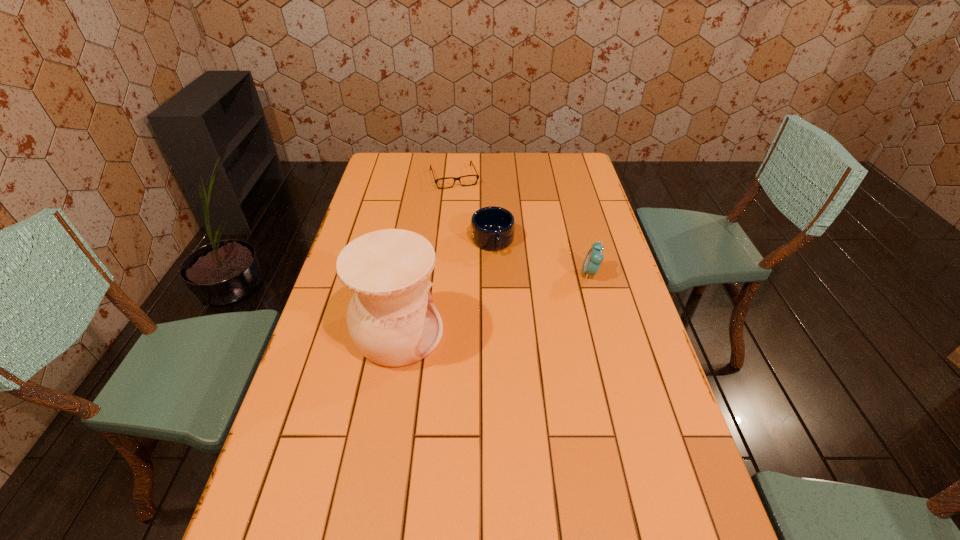
I want to click on object present at the right edge, so click(x=594, y=258).

The image size is (960, 540). I want to click on vacant region at the far edge of the desktop, so click(493, 176).

You are a GUI agent. You are given a task and a screenshot of the screen. Output one action in this format:
    pyautogui.click(x=<x>, y=<y>)
    Task: Click on the free space at the near edge of the desktop
    The image size is (960, 540).
    Given the screenshot: What is the action you would take?
    pyautogui.click(x=582, y=527)

I want to click on free point at the left edge, so click(351, 297).

Where is `vacant space at the right edge of the desktop`? Image resolution: width=960 pixels, height=540 pixels. vacant space at the right edge of the desktop is located at coordinates (608, 228).

The width and height of the screenshot is (960, 540). I want to click on free point at the far left corner, so click(x=377, y=173).

At what (x,y) coordinates should I click in order to perform the action: click on free space at the near left corner of the desktop. Please return your answer as a coordinate pair (x, y). Looking at the image, I should click on [309, 501].

In the image, there is a desktop. Where is `vacant space at the far right corner`? The height and width of the screenshot is (540, 960). vacant space at the far right corner is located at coordinates (552, 166).

The image size is (960, 540). I want to click on empty location between the nearest object and the third shortest object, so click(494, 303).

The width and height of the screenshot is (960, 540). I want to click on vacant region between the third nearest object and the spectacles, so click(473, 209).